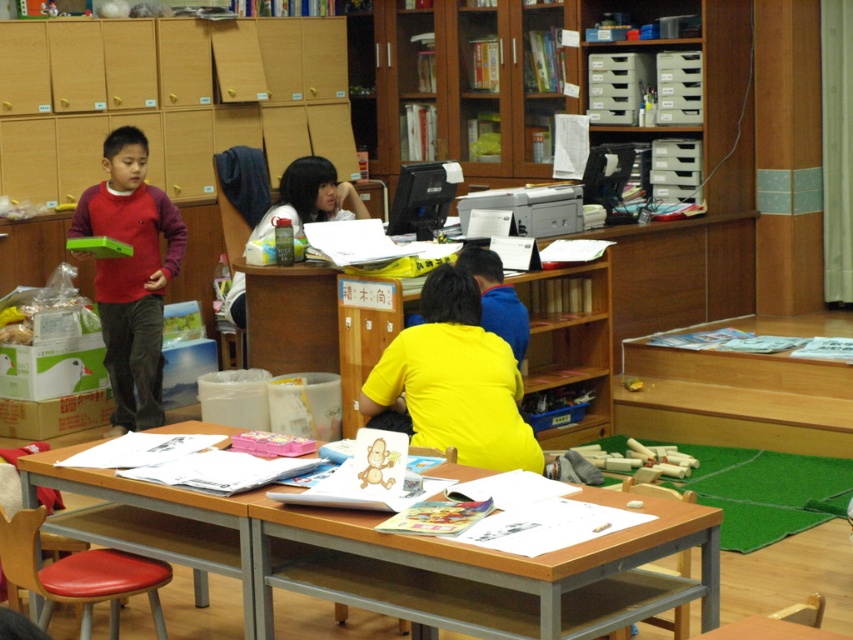
Between point (131, 289) and point (335, 196), which one is positioned behind?

Point (335, 196)

Is matte red sweater at left to the right of matte yellow shirt at center from the viewer's perspective?

In fact, matte red sweater at left is to the left of matte yellow shirt at center.

Find the location of a particular element. matte red sweater at left is located at coordinates (131, 275).

The width and height of the screenshot is (853, 640). I want to click on matte red sweater at left, so click(131, 275).

Between wooden at center and yellow matte shirt at center, which one is positioned higher?

yellow matte shirt at center is higher up.

Is wooden at center positioned before yellow matte shirt at center?

Yes, it is in front of yellow matte shirt at center.

Based on the photo, who is more distant from viewer, (45, 476) or (386, 356)?

The point (386, 356) is behind.

This screenshot has height=640, width=853. I want to click on wooden at center, so click(x=399, y=544).

Is wooden at center further to camera compared to matte red sweater at left?

No, it is not.

Can you confirm if wooden at center is positioned to the right of matte red sweater at left?

Correct, you'll find wooden at center to the right of matte red sweater at left.

Is point (99, 483) more distant than point (166, 234)?

No.

Find the location of a particular element. wooden at center is located at coordinates (399, 544).